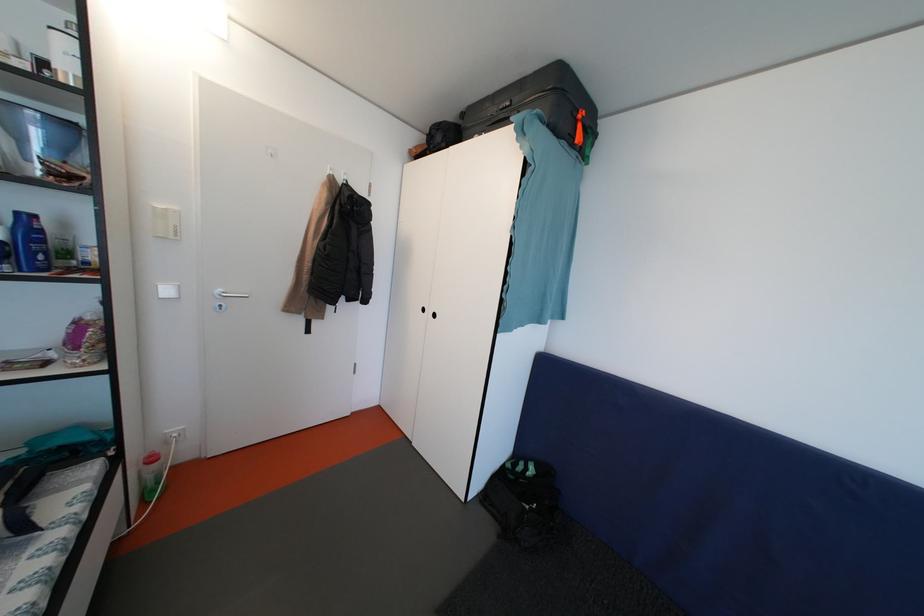
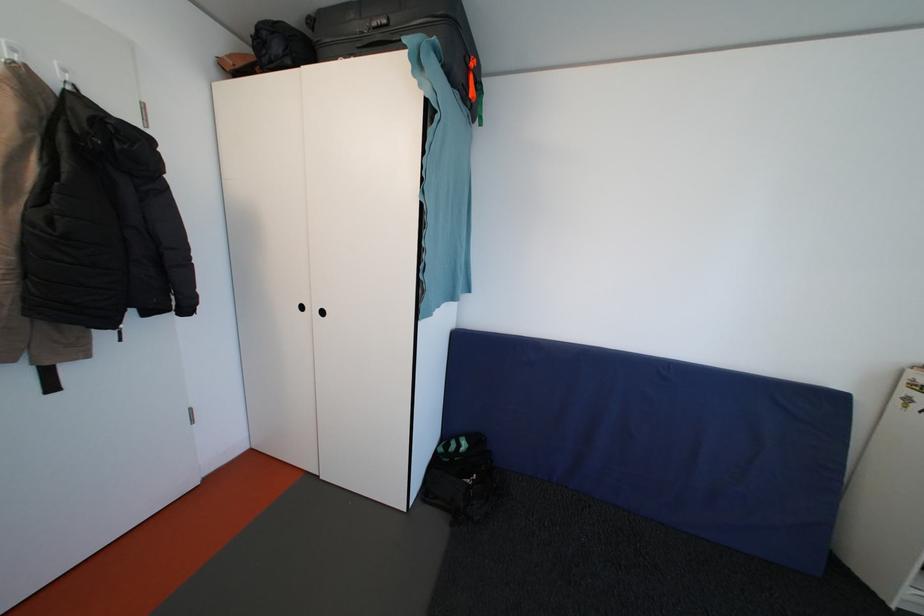
Question: The first image is from the beginning of the video and the second image is from the end. How did the camera likely rotate when shooting the video?

Choices:
 (A) Left
 (B) Right
 (C) Up
 (D) Down

Answer: (B)